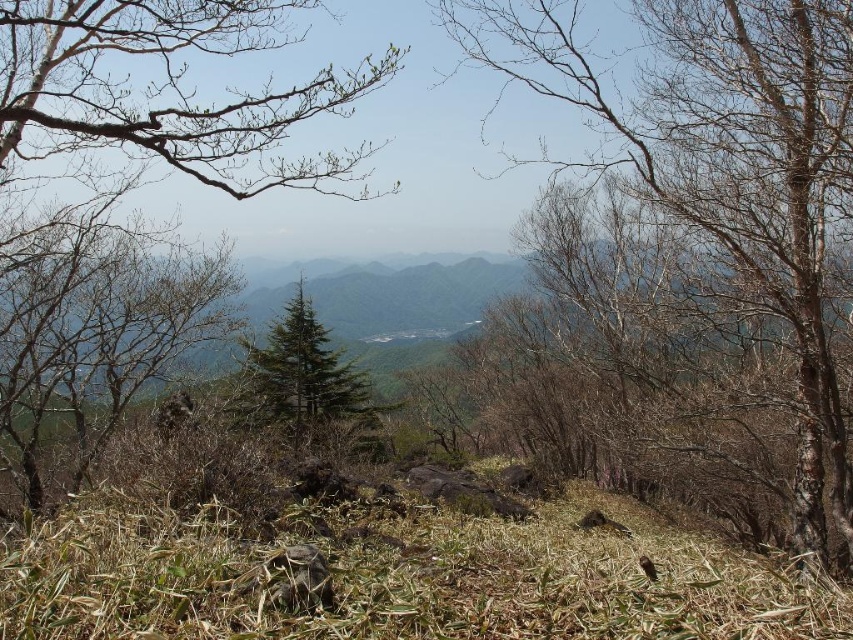
Does green grassy at center lie in front of green leafy branch at upper left?

That is True.

Does green grassy at center appear on the left side of green leafy branch at upper left?

In fact, green grassy at center is to the right of green leafy branch at upper left.

Does point (805, 618) lie behind point (234, 157)?

No, it is in front of (234, 157).

What are the coordinates of `green grassy at center` in the screenshot? It's located at (395, 580).

Between green leafy branch at upper left and green textured tree at center, which one appears on the right side from the viewer's perspective?

green leafy branch at upper left

Who is higher up, green leafy branch at upper left or green textured tree at center?

green leafy branch at upper left is higher up.

Is point (265, 20) closer to camera compared to point (277, 412)?

Yes, point (265, 20) is closer to viewer.

Where is `green leafy branch at upper left`? The height and width of the screenshot is (640, 853). green leafy branch at upper left is located at coordinates (170, 92).

Is bare bark tree at center taller than green leafy branch at upper left?

Correct, bare bark tree at center is much taller as green leafy branch at upper left.

Between bare bark tree at center and green leafy branch at upper left, which one has less height?

green leafy branch at upper left is shorter.

Locate an element on the screen. bare bark tree at center is located at coordinates (723, 193).

Find the location of `bare bark tree at center`. bare bark tree at center is located at coordinates (723, 193).